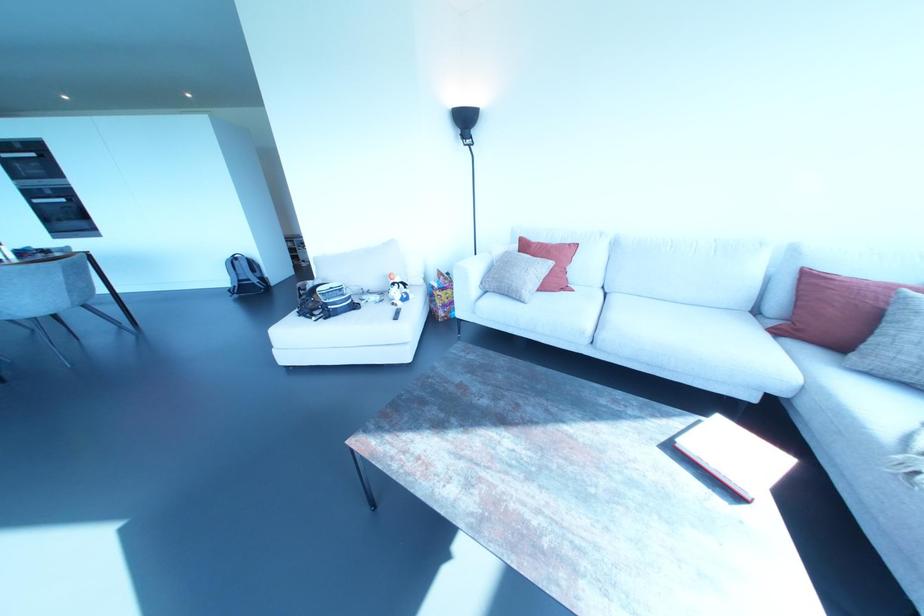
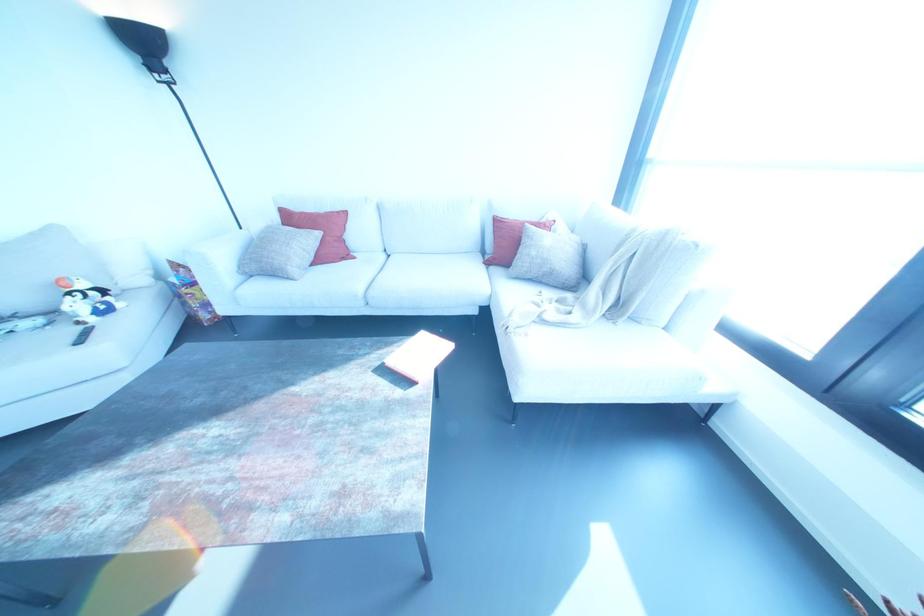
In the second image, find the point that corresponds to (x=392, y=302) in the first image.

(78, 322)